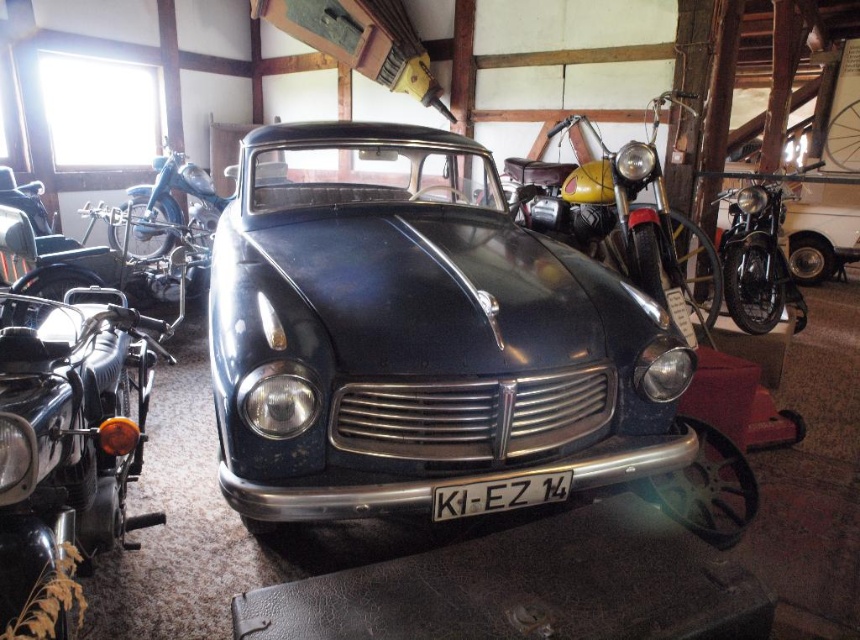
Can you confirm if shiny chrome motorcycle at right is thinner than white plastic license plate at center?

No.

Which is behind, point (736, 208) or point (530, 506)?

Positioned behind is point (736, 208).

Find the location of `shiny chrome motorcycle at right`. shiny chrome motorcycle at right is located at coordinates (756, 260).

Does glossy dark blue car at center have a lesser height compared to shiny chrome motorcycle at right?

In fact, glossy dark blue car at center may be taller than shiny chrome motorcycle at right.

This screenshot has height=640, width=860. I want to click on glossy dark blue car at center, so click(x=416, y=333).

Which is in front, point (431, 227) or point (741, 204)?

Point (431, 227) is more forward.

Where is `glossy dark blue car at center`? The width and height of the screenshot is (860, 640). glossy dark blue car at center is located at coordinates (416, 333).

Is shiny black motorcycle at left to the left of yellow matte motorcycle at center from the viewer's perspective?

Indeed, shiny black motorcycle at left is positioned on the left side of yellow matte motorcycle at center.

Is shiny black motorcycle at left further to the viewer compared to yellow matte motorcycle at center?

No, it is in front of yellow matte motorcycle at center.

Is point (43, 499) farther from camera compared to point (698, 236)?

No, (43, 499) is closer to viewer.

Image resolution: width=860 pixels, height=640 pixels. Identify the location of shiny black motorcycle at left. (68, 433).